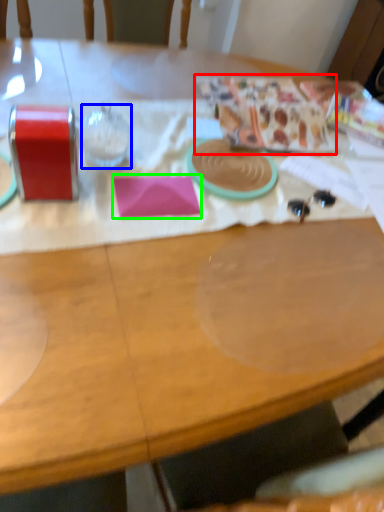
Question: Which is farther away from wrapping paper (highlighted by a red box)? wine glass (highlighted by a blue box) or notepad (highlighted by a green box)?

Choices:
 (A) wine glass
 (B) notepad

Answer: (A)